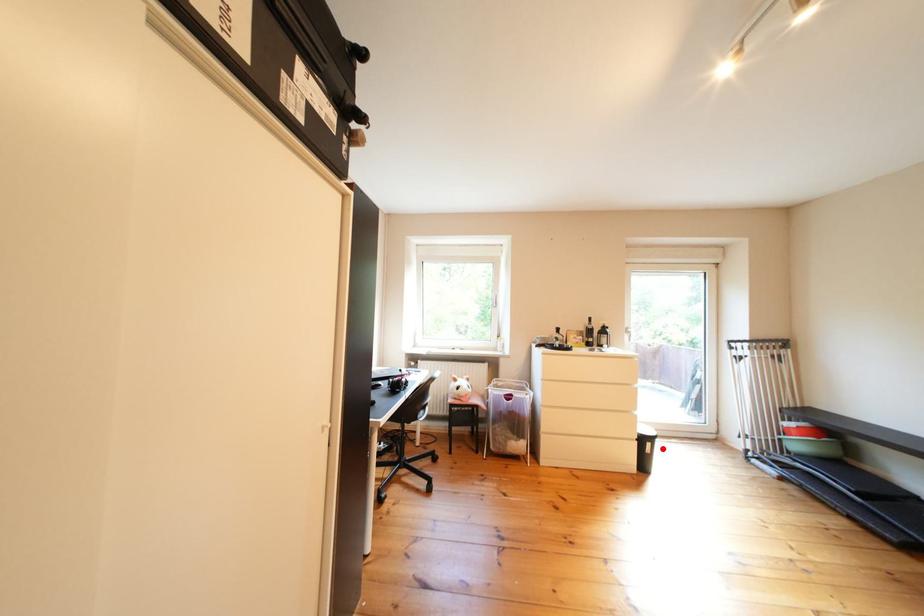
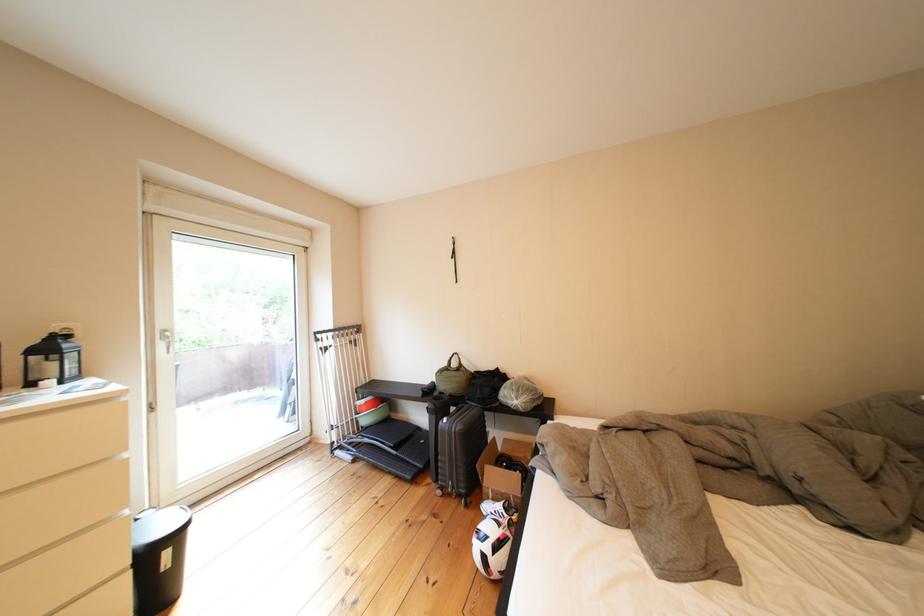
Find the pixel in the second image that matches the highlighted location in the first image.

(179, 557)